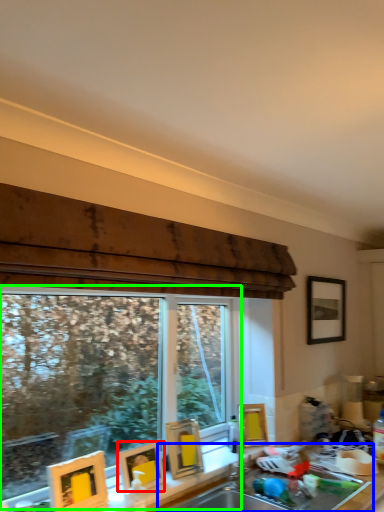
Question: Which is nearer to the picture frame (highlighted by a red box)? sink (highlighted by a blue box) or window (highlighted by a green box).

Choices:
 (A) sink
 (B) window

Answer: (A)